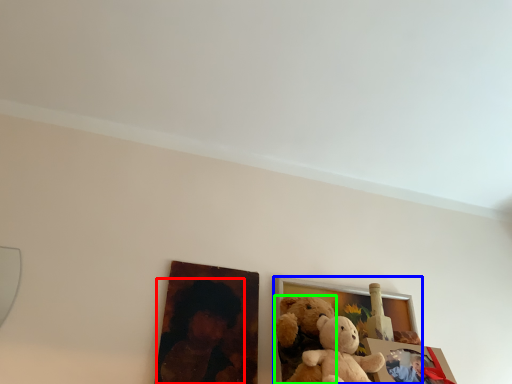
Question: Considering the real-world distances, which object is closest to person (highlighted by a red box)? picture frame (highlighted by a blue box) or teddy bear (highlighted by a green box).

Choices:
 (A) picture frame
 (B) teddy bear

Answer: (B)